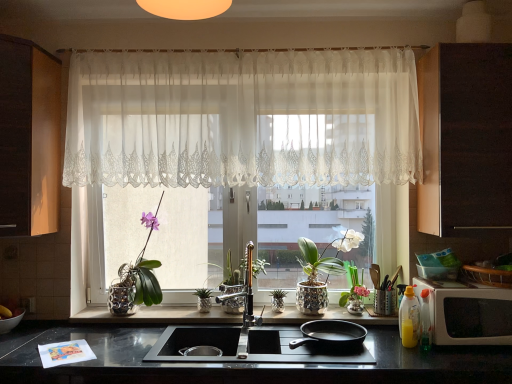
Image resolution: width=512 pixels, height=384 pixels. I want to click on unoccupied region to the right of translucent plastic bottle at lower right, so click(456, 352).